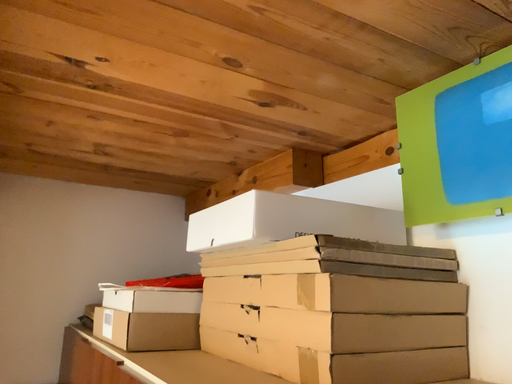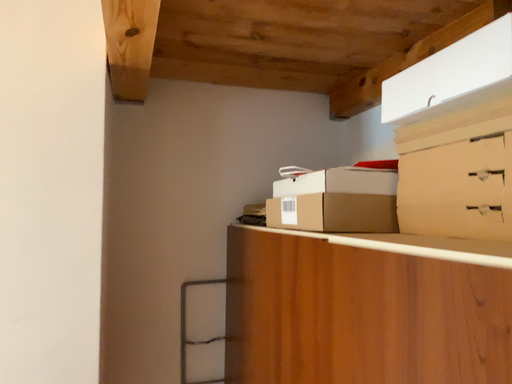
Question: Which way did the camera rotate in the video?

Choices:
 (A) rotated left
 (B) rotated right

Answer: (A)